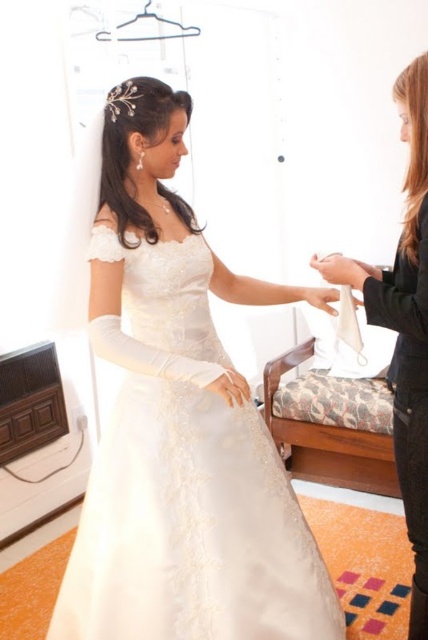
Is point (133, 397) closer to viewer compared to point (413, 308)?

No, it is behind (413, 308).

Find the location of `satin dress at center`. satin dress at center is located at coordinates (180, 424).